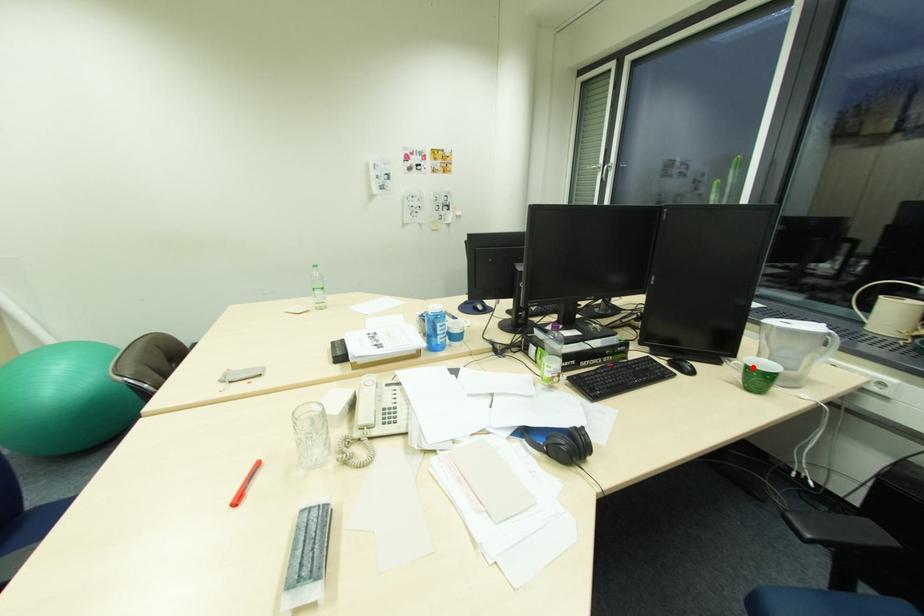
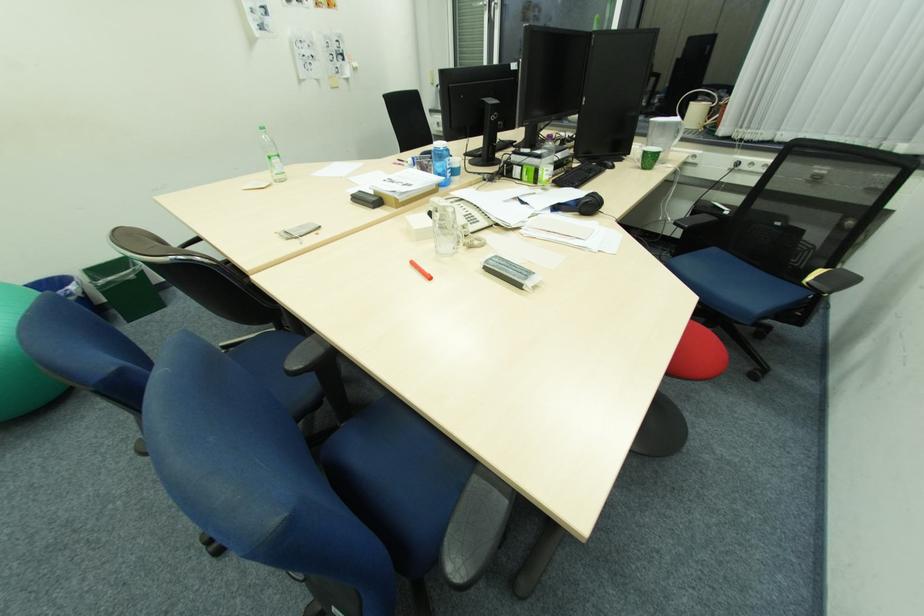
In the second image, find the point that corresponds to the highlighted location in the first image.

(650, 153)